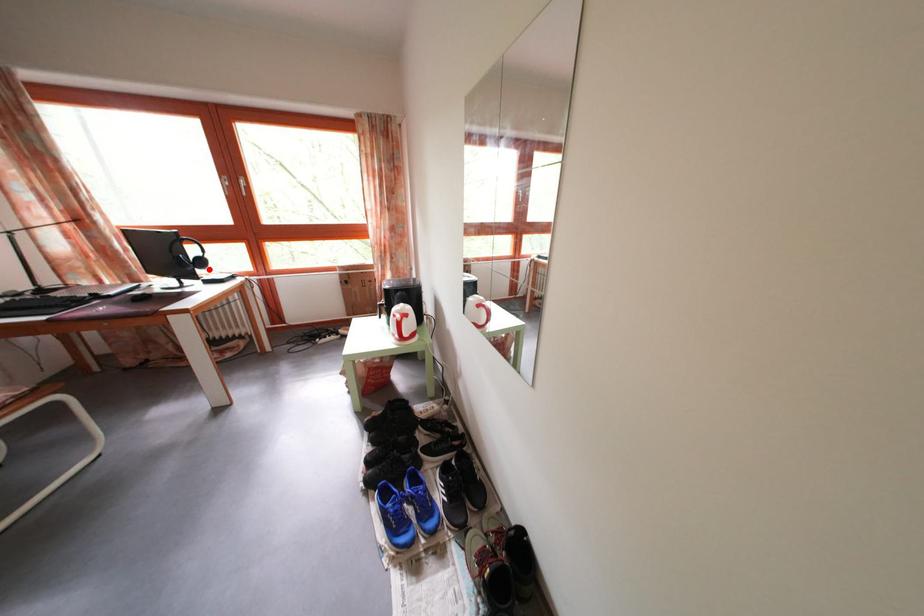
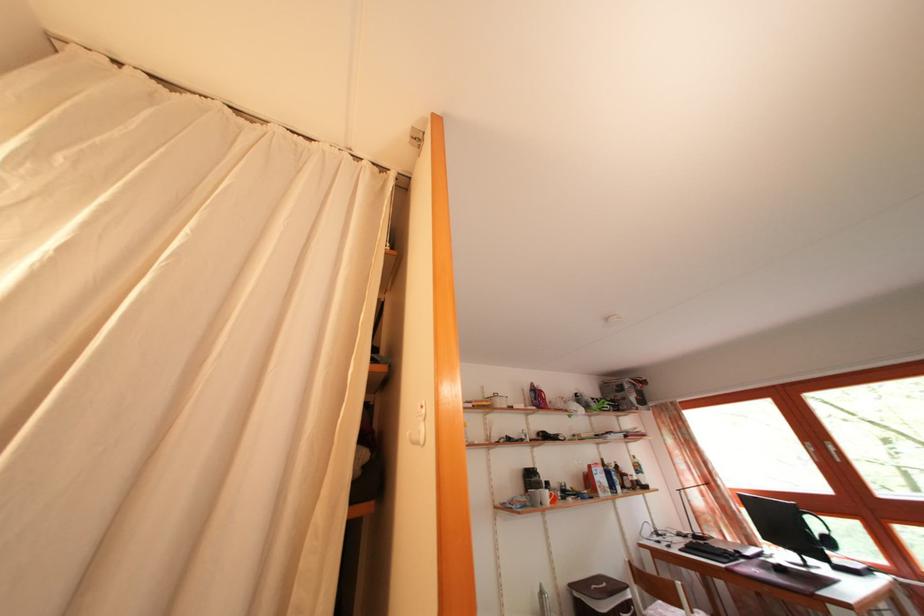
Locate, in the second image, the point that corresponds to the highlighted location in the first image.

(837, 549)